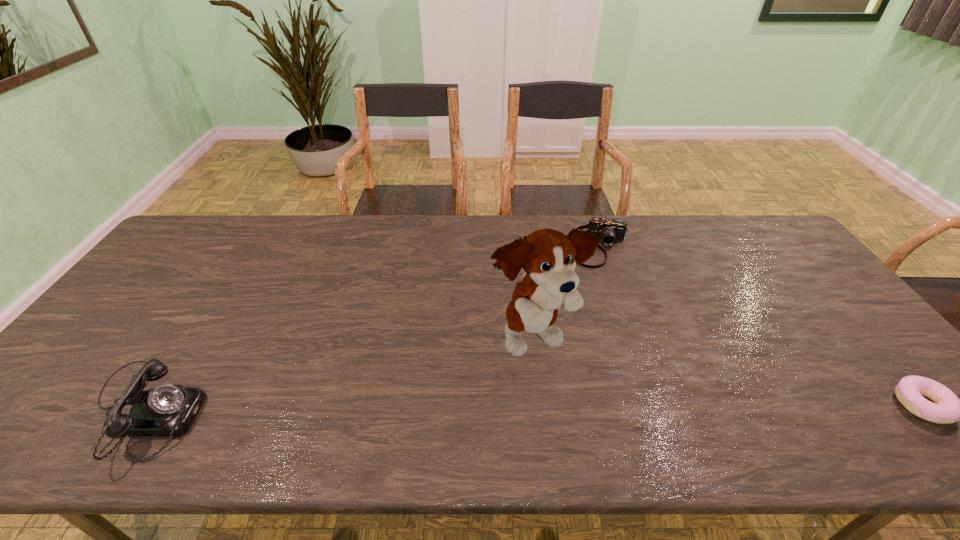
The height and width of the screenshot is (540, 960). I want to click on free space at the far right corner, so click(x=781, y=236).

Locate an element on the screen. vacant space that is in between the puppy and the second tallest object is located at coordinates (339, 374).

I want to click on free space between the telephone and the tallest object, so click(339, 374).

Identify which object is the second nearest to the camera. Please provide its 2D coordinates. Your answer should be formatted as a tuple, i.e. [(x, y)], where the tuple contains the x and y coordinates of a point satisfying the conditions above.

[(947, 408)]

Image resolution: width=960 pixels, height=540 pixels. Identify the location of object that is the closest to the camera. [548, 257].

This screenshot has width=960, height=540. What are the coordinates of `free space that satisfies the following two spatial constraints: 1. on the back side of the tallest object; 2. on the right side of the second object from right to left` in the screenshot? It's located at (524, 246).

The height and width of the screenshot is (540, 960). Identify the location of free location that satisfies the following two spatial constraints: 1. on the back side of the tallest object; 2. on the left side of the camera. (524, 246).